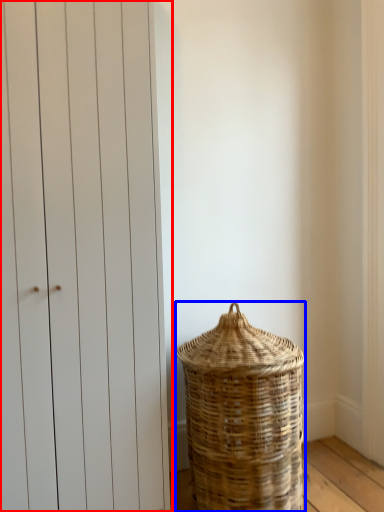
Question: Among these objects, which one is nearest to the camera, door (highlighted by a red box) or basket (highlighted by a blue box)?

Choices:
 (A) door
 (B) basket

Answer: (A)